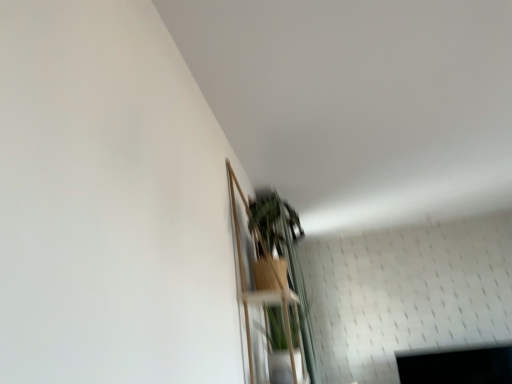
Question: From the image's perspective, is wooden shelf at lower center, which ranks as the second shelf in top-to-bottom order, positioned above or below wooden shelf at upper center, the second shelf in the bottom-to-top sequence?

Choices:
 (A) above
 (B) below

Answer: (B)

Question: Is wooden shelf at lower center, the first shelf ordered from the bottom, to the left or to the right of wooden shelf at upper center, the second shelf in the bottom-to-top sequence, in the image?

Choices:
 (A) left
 (B) right

Answer: (B)

Question: In the image, is wooden shelf at lower center, the first shelf ordered from the bottom, positioned in front of or behind wooden shelf at upper center, the second shelf in the bottom-to-top sequence?

Choices:
 (A) front
 (B) behind

Answer: (B)

Question: Which is correct: wooden shelf at upper center, the second shelf in the bottom-to-top sequence, is inside wooden shelf at lower center, which ranks as the second shelf in top-to-bottom order, or outside of it?

Choices:
 (A) inside
 (B) outside

Answer: (B)

Question: Is point (243, 291) positioned closer to the camera than point (250, 354)?

Choices:
 (A) farther
 (B) closer

Answer: (B)

Question: From their relative heights in the image, would you say wooden shelf at upper center, the 1th shelf positioned from the top, is taller or shorter than wooden shelf at lower center, which ranks as the second shelf in top-to-bottom order?

Choices:
 (A) short
 (B) tall

Answer: (B)

Question: Looking at the image, does wooden shelf at upper center, the second shelf in the bottom-to-top sequence, seem bigger or smaller compared to wooden shelf at lower center, which ranks as the second shelf in top-to-bottom order?

Choices:
 (A) small
 (B) big

Answer: (B)